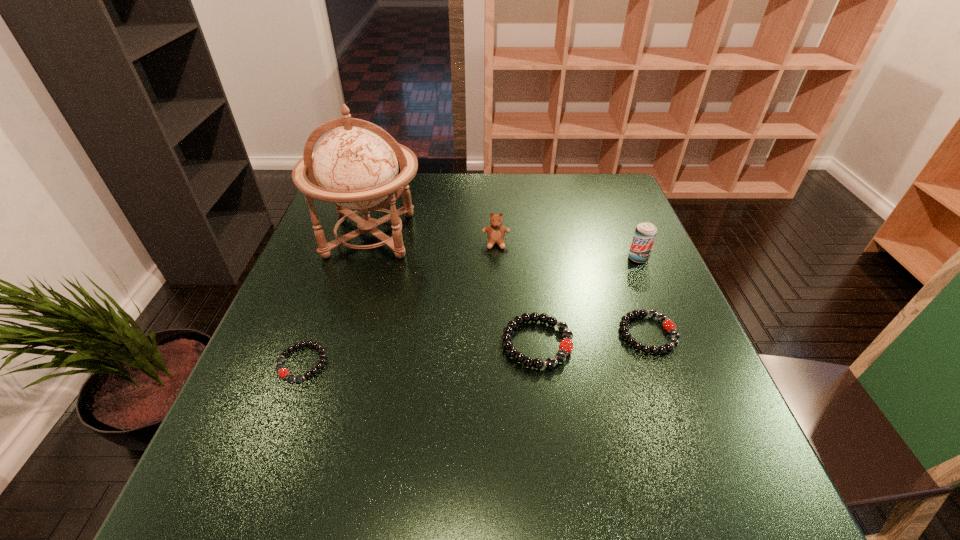
Find the location of a particular element. The image size is (960, 540). the shortest bracelet is located at coordinates (x=283, y=372).

The height and width of the screenshot is (540, 960). I want to click on the shortest object, so click(x=283, y=372).

The image size is (960, 540). I want to click on the third shortest object, so click(x=566, y=345).

Where is `the tallest bracelet`? This screenshot has width=960, height=540. the tallest bracelet is located at coordinates coord(566,345).

Image resolution: width=960 pixels, height=540 pixels. Find the location of `the rightmost bracelet`. the rightmost bracelet is located at coordinates (669, 326).

Find the location of a particular element. This screenshot has height=540, width=960. the second shortest bracelet is located at coordinates coord(669,326).

Find the location of a particular element. This screenshot has height=540, width=960. globe is located at coordinates (354, 166).

At what (x,y) coordinates should I click in order to perform the action: click on teddy bear. Please return your answer as a coordinate pair (x, y). This screenshot has width=960, height=540. Looking at the image, I should click on (495, 232).

Find the location of `beer can`. beer can is located at coordinates (645, 233).

At what (x,y) coordinates should I click in order to perform the action: click on free space located 0.400m on the back of the shortest bracelet. Please return your answer as a coordinate pair (x, y). The image size is (960, 540). Looking at the image, I should click on (350, 232).